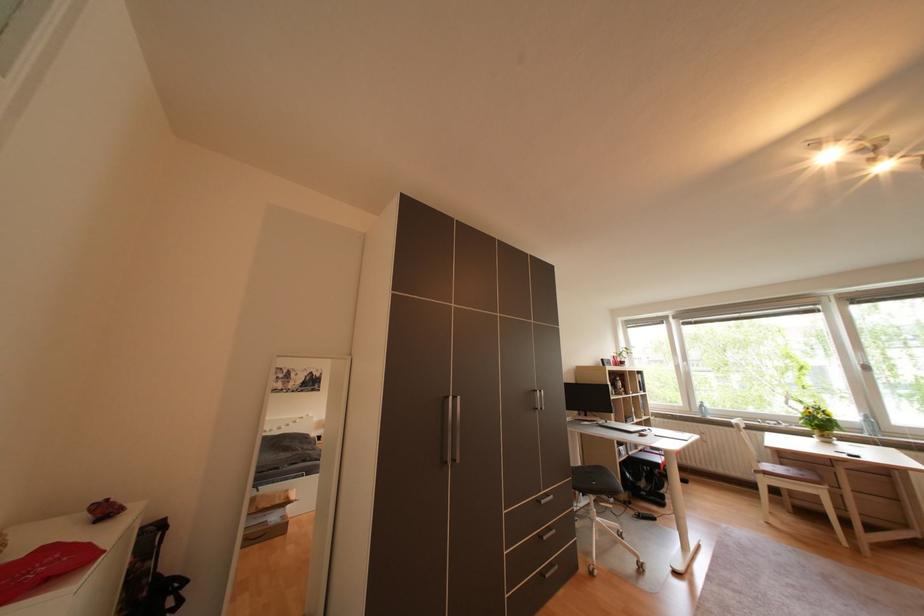
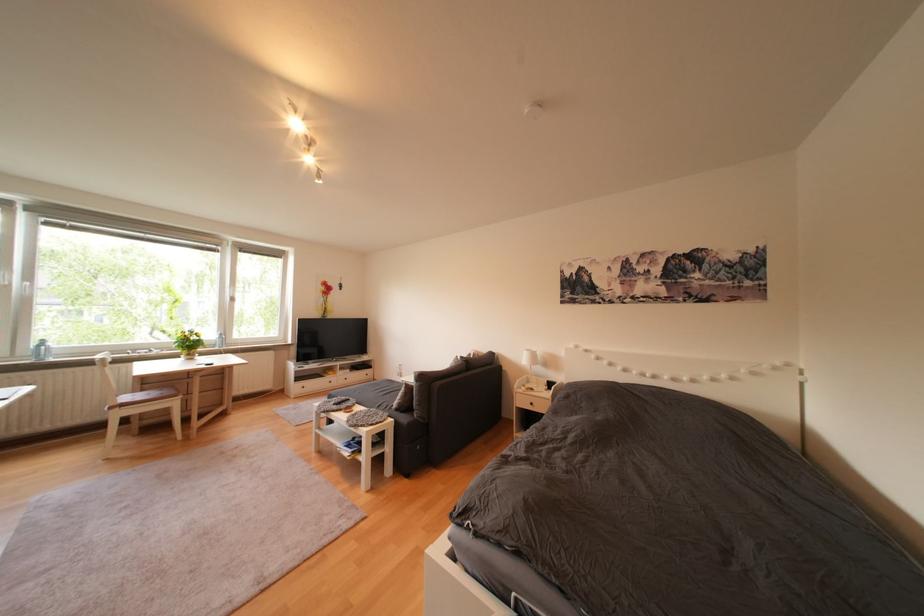
Question: The camera is either moving clockwise (left) or counter-clockwise (right) around the object. The first image is from the beginning of the video and the second image is from the end. Is the camera moving left or right when shooting the video?

Choices:
 (A) Left
 (B) Right

Answer: (A)